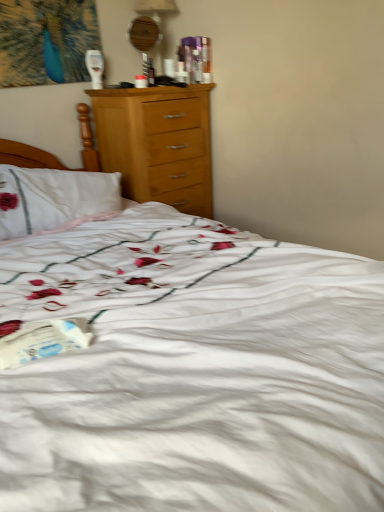
Question: In terms of size, does white paper at lower left appear bigger or smaller than wooden table lamp at upper center?

Choices:
 (A) small
 (B) big

Answer: (A)

Question: Is point (23, 329) closer or farther from the camera than point (135, 7)?

Choices:
 (A) farther
 (B) closer

Answer: (B)

Question: From their relative heights in the image, would you say white paper at lower left is taller or shorter than wooden table lamp at upper center?

Choices:
 (A) tall
 (B) short

Answer: (B)

Question: Is wooden table lamp at upper center in front of or behind white paper at lower left in the image?

Choices:
 (A) behind
 (B) front

Answer: (A)

Question: Considering the positions of point [x=168, y=8] and point [x=3, y=348], is point [x=168, y=8] closer or farther from the camera than point [x=3, y=348]?

Choices:
 (A) closer
 (B) farther

Answer: (B)

Question: Looking at their shapes, would you say wooden table lamp at upper center is wider or thinner than white paper at lower left?

Choices:
 (A) thin
 (B) wide

Answer: (A)

Question: Is wooden table lamp at upper center bigger or smaller than white paper at lower left?

Choices:
 (A) big
 (B) small

Answer: (A)